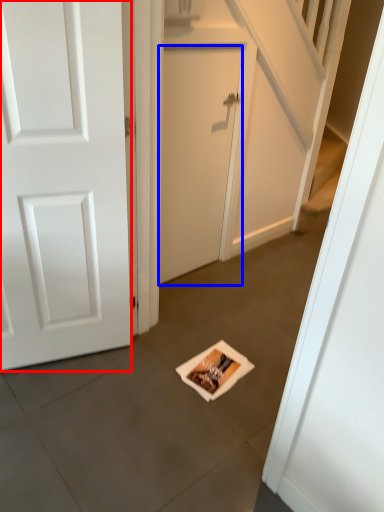
Question: Which point is further to the camera, door (highlighted by a red box) or door (highlighted by a blue box)?

Choices:
 (A) door
 (B) door

Answer: (B)